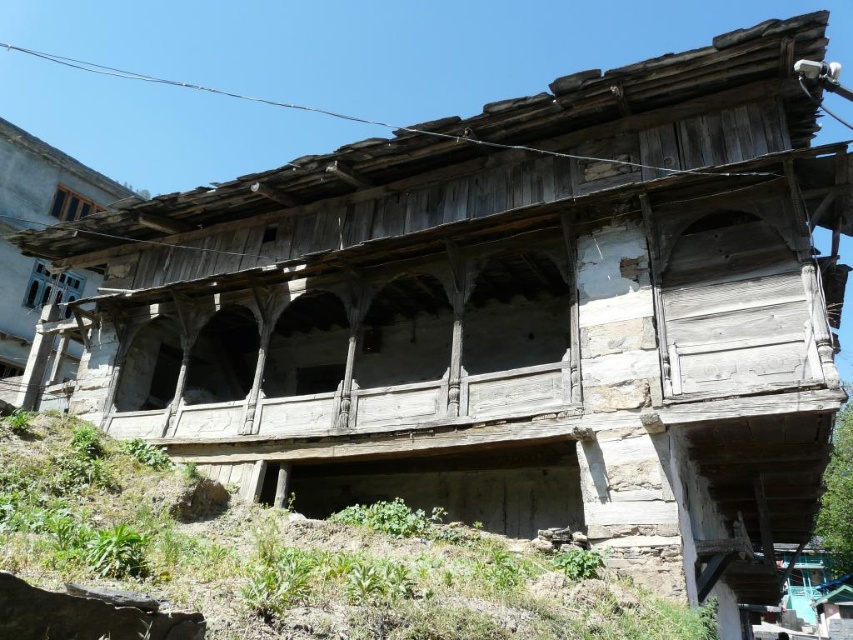
You are standing at the base of the weathered stone hillside at lower center and want to reach the blue painted wood window at upper left. Which direction should you move to get closer to the window?

To reach the blue painted wood window at upper left from the weathered stone hillside at lower center, you should move upwards since the hillside is below the window.

You are a painter who needs to reach the blue painted wood window at upper left from the weathered stone hillside at lower center. You have a ladder that is 12 meters long. Can you safely reach the window using this ladder?

The distance between the weathered stone hillside at lower center and the blue painted wood window at upper left is 12.25 meters. Since the ladder is only 12 meters long, it is 25 centimeters shorter than needed. Therefore, the ladder is not long enough to safely reach the window.

You are a painter who wants to paint both the weathered stone hillside at lower center and the blue painted wood window at upper left. Which object takes up more space in the image?

The blue painted wood window at upper left takes up more space in the image than the weathered stone hillside at lower center.